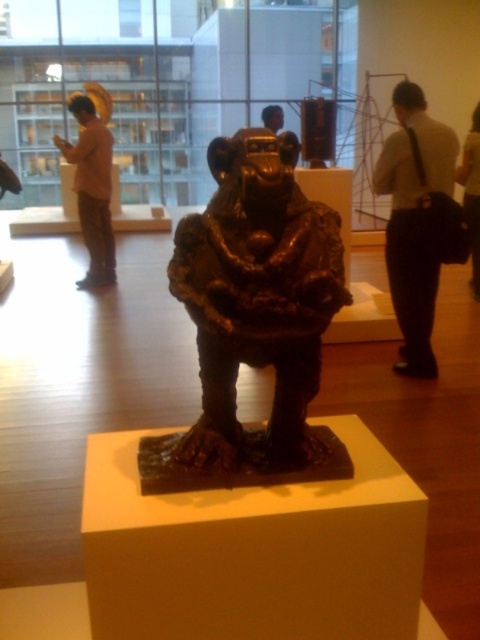
Question: Which object is farther from the camera taking this photo?

Choices:
 (A) matte black statue at center
 (B) bronze/statue at center
 (C) white shirt and black pants at right
 (D) matte gold statue at upper left

Answer: (A)

Question: Does smooth black shirt at upper right have a smaller size compared to matte black statue at center?

Choices:
 (A) yes
 (B) no

Answer: (B)

Question: Which point appears closest to the camera in this image?

Choices:
 (A) (427, 256)
 (B) (101, 240)
 (C) (470, 195)
 (D) (264, 108)

Answer: (A)

Question: Estimate the real-world distances between objects in this image. Which object is farther from the bronze/statue at center?

Choices:
 (A) matte gold statue at upper left
 (B) matte black statue at center

Answer: (B)

Question: Is white shirt and black pants at right bigger than matte gold statue at upper left?

Choices:
 (A) no
 (B) yes

Answer: (B)

Question: Is white shirt and black pants at right positioned before matte gold statue at upper left?

Choices:
 (A) yes
 (B) no

Answer: (A)